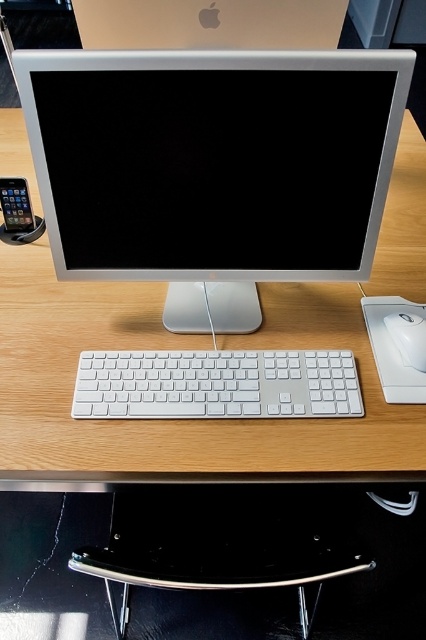
Question: Does sleek silver monitor at center lie behind wooden desk at center?

Choices:
 (A) yes
 (B) no

Answer: (B)

Question: Which object is the farthest from the wooden desk at center?

Choices:
 (A) satin black smartphone at left
 (B) white plastic mouse at lower right
 (C) sleek silver monitor at center

Answer: (A)

Question: Does white plastic keyboard at center lie in front of white plastic mouse at lower right?

Choices:
 (A) no
 (B) yes

Answer: (B)

Question: Which is nearer to the white plastic mouse at lower right?

Choices:
 (A) sleek silver monitor at center
 (B) satin black smartphone at left
 (C) white plastic keyboard at center

Answer: (C)

Question: Is sleek silver monitor at center closer to the viewer compared to white plastic mouse at lower right?

Choices:
 (A) yes
 (B) no

Answer: (A)

Question: Which object appears farthest from the camera in this image?

Choices:
 (A) satin black smartphone at left
 (B) sleek silver monitor at center
 (C) wooden desk at center

Answer: (A)